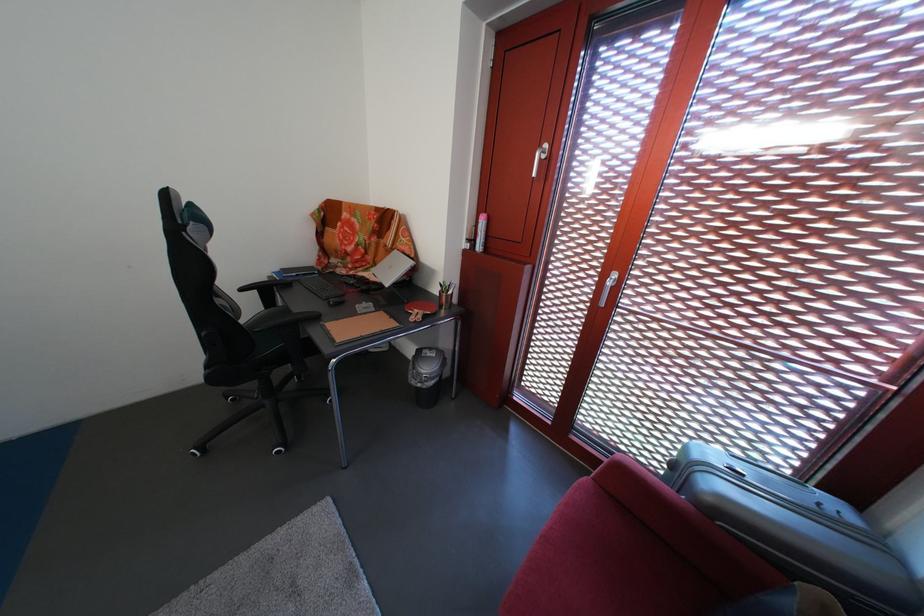
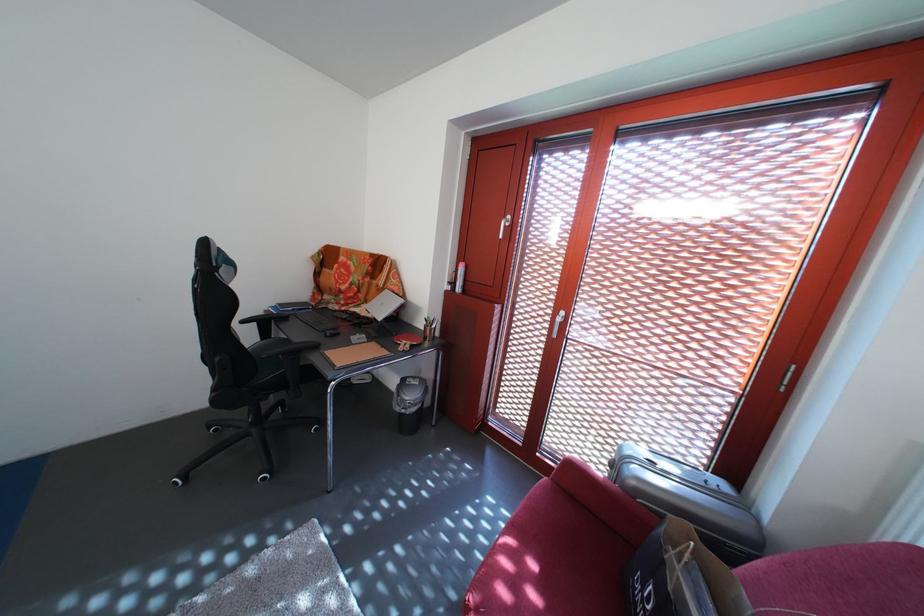
Where in the second image is the point corresponding to the point at 424,389 from the first image?

(408, 416)